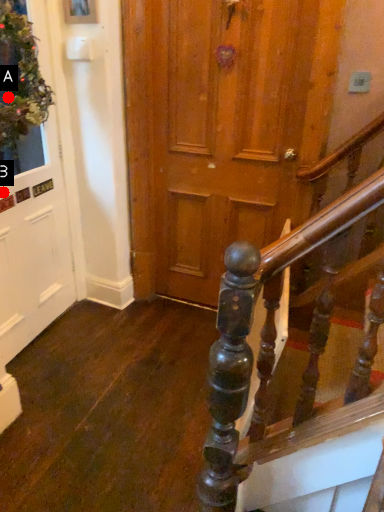
Question: Two points are circled on the image, labeled by A and B beside each circle. Which point is closer to the camera taking this photo?

Choices:
 (A) A is closer
 (B) B is closer

Answer: (B)